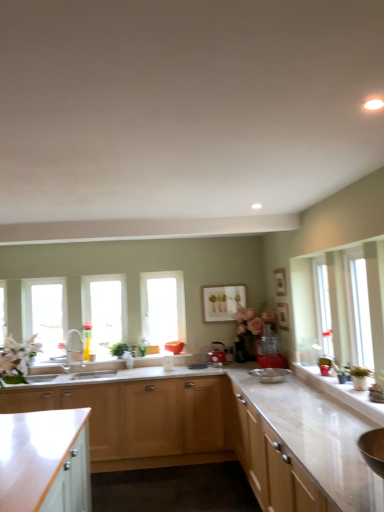
Question: From the image's perspective, relative to matte white picture frame at center, is red plastic blender at center, positioned as the first appliance in right-to-left order, above or below?

Choices:
 (A) below
 (B) above

Answer: (A)

Question: Considering the positions of red plastic blender at center, the first appliance viewed from the front, and matte white picture frame at center in the image, is red plastic blender at center, the first appliance viewed from the front, taller or shorter than matte white picture frame at center?

Choices:
 (A) short
 (B) tall

Answer: (A)

Question: Which of these objects is positioned farthest from the transparent glass window at center, which ranks as the third window in left-to-right order?

Choices:
 (A) matte white picture frame at center
 (B) white glossy counter top at right
 (C) white marble countertop at lower center
 (D) clear glass window at left, acting as the 3th window starting from the right
 (E) light wood cabinet at right, placed as the third cabinetry when sorted from left to right

Answer: (B)

Question: Based on their relative distances, which object is farther from the transparent glass window at center, which ranks as the third window in left-to-right order?

Choices:
 (A) clear glass window at center, the 2th window from the right
 (B) white glossy cabinet at lower left, positioned as the third cabinetry in right-to-left order
 (C) light wood cabinet at lower center, which is the 2th cabinetry in right-to-left order
 (D) clear glass window at left, acting as the 3th window starting from the right
 (E) metallic red kettle at center, which is the first appliance in left-to-right order

Answer: (B)